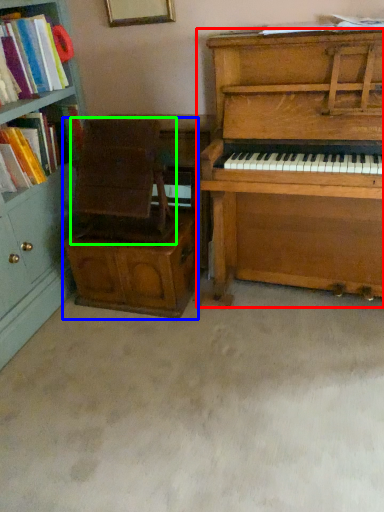
Question: Which is farther away from piano (highlighted by a red box)? armchair (highlighted by a blue box) or armchair (highlighted by a green box)?

Choices:
 (A) armchair
 (B) armchair

Answer: (B)